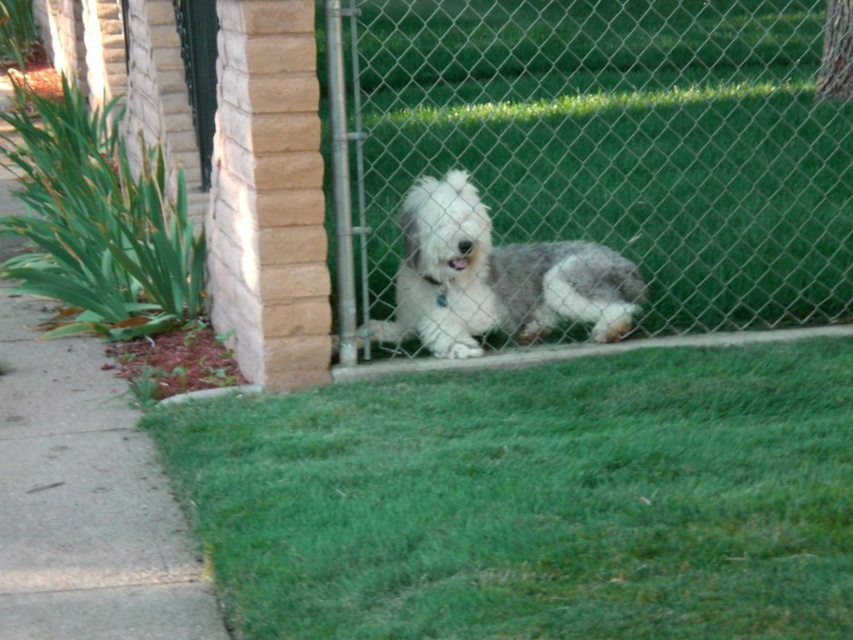
You are a gardener who wants to mow the lawn. You see the green grass at lower center and the green leafy grass at lower left. Which area requires mowing first based on their height?

The green leafy grass at lower left requires mowing first because it is taller than the green grass at lower center.

You are standing in front of the chain link fence where the dog is lying. You want to walk towards the green leafy grass at lower left. Which direction should you move relative to the green grass at lower center?

Since the green grass at lower center is closer to you than the green leafy grass at lower left, you should move to your left to reach the green leafy grass at lower left.